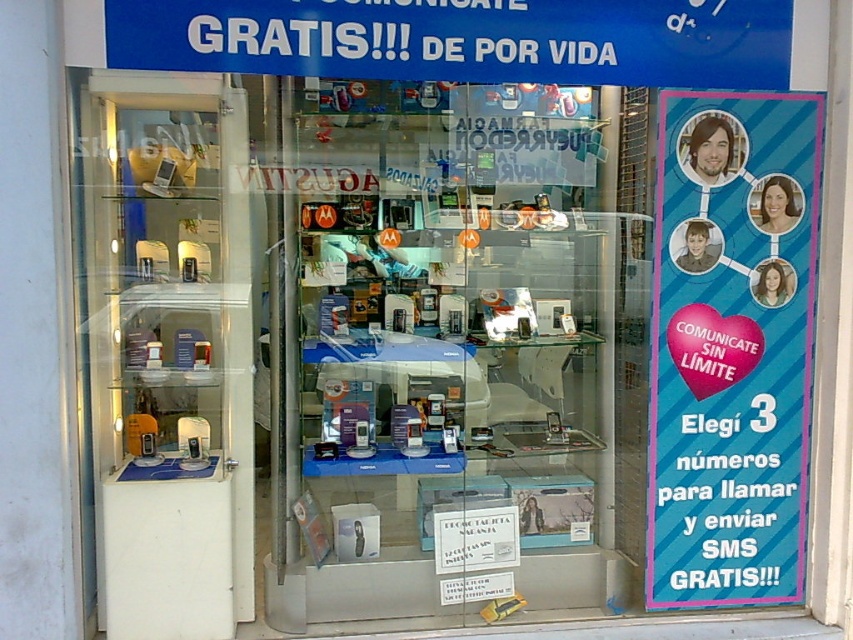
You are a customer entering the mobile phone store and want to see the items on the transparent glass display at center and the blue striped poster at right. Which object would you need to look up more to see?

The transparent glass display at center is much taller than the blue striped poster at right, so you would need to look up more to see the transparent glass display at center.